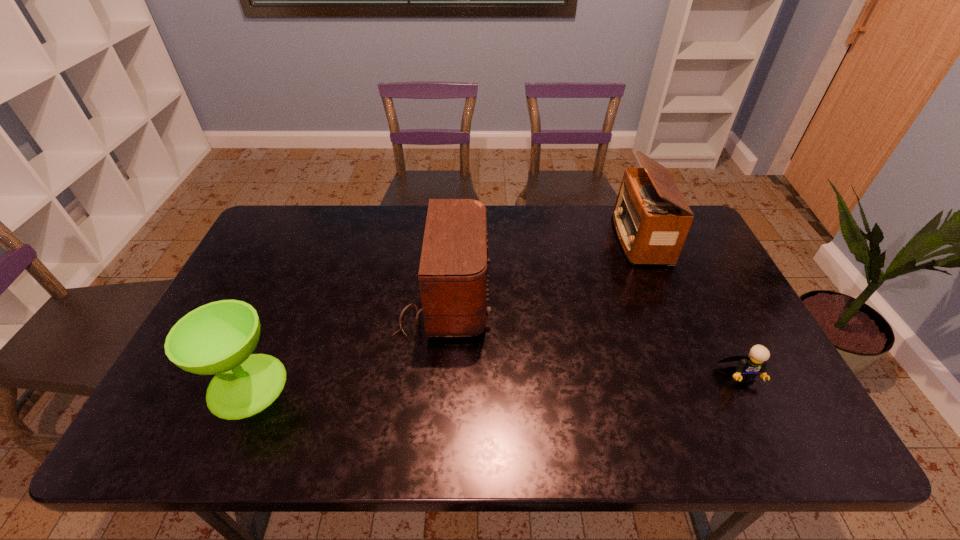
You are a GUI agent. You are given a task and a screenshot of the screen. Output one action in this format:
    pyautogui.click(x=<x>, y=<y>)
    Task: Click on the right radio receiver
    This screenshot has width=960, height=540.
    Given the screenshot: What is the action you would take?
    pyautogui.click(x=652, y=219)

The height and width of the screenshot is (540, 960). I want to click on the left radio receiver, so click(453, 278).

In order to click on wineglass in this screenshot , I will do `click(218, 338)`.

Image resolution: width=960 pixels, height=540 pixels. I want to click on the third tallest object, so click(218, 338).

At what (x,y) coordinates should I click in order to perform the action: click on Lego. Please return your answer as a coordinate pair (x, y). Looking at the image, I should click on coord(749,366).

Identify the location of free space located on the front panel of the right radio receiver. (587, 238).

Locate an element on the screen. free space located on the front panel of the right radio receiver is located at coordinates (599, 238).

The width and height of the screenshot is (960, 540). Find the location of `free region located on the front panel of the right radio receiver`. free region located on the front panel of the right radio receiver is located at coordinates (574, 238).

Locate an element on the screen. This screenshot has height=540, width=960. vacant region located on the front panel of the second object from left to right is located at coordinates (536, 299).

At what (x,y) coordinates should I click in order to perform the action: click on vacant space located on the right of the wineglass. Please return your answer as a coordinate pair (x, y). The image size is (960, 540). Looking at the image, I should click on (305, 385).